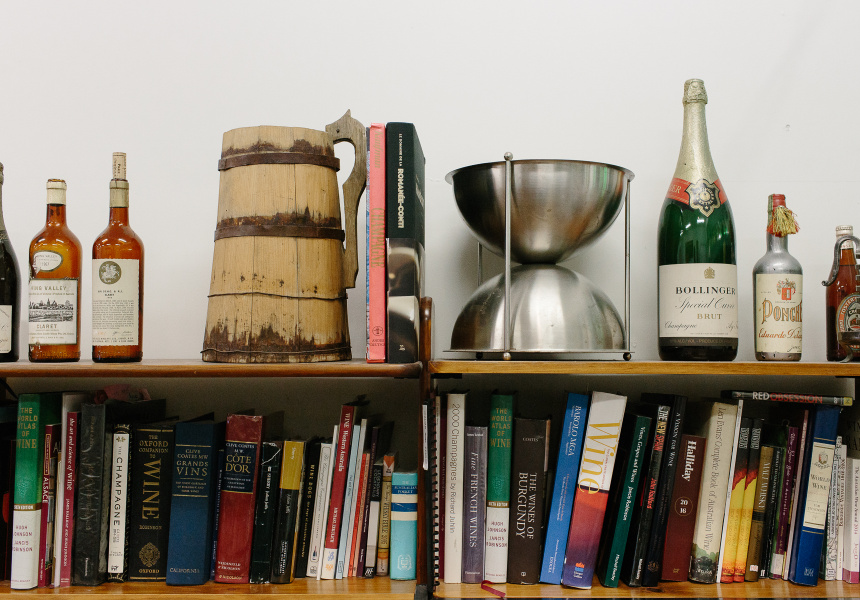
Where is `center vertical shelf seperator`? The image size is (860, 600). center vertical shelf seperator is located at coordinates (427, 341), (430, 551).